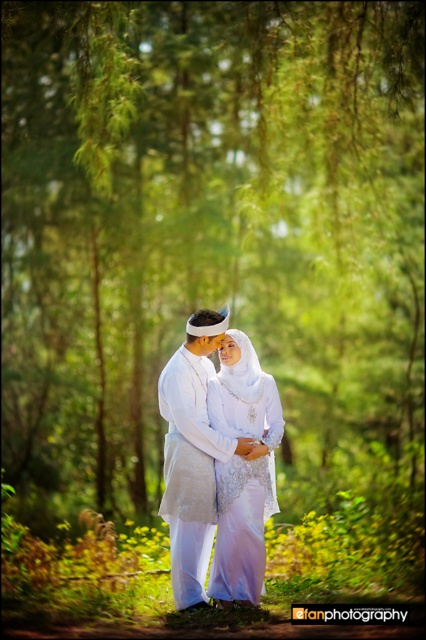
Is point (226, 593) positioned behind point (176, 460)?

No, it is in front of (176, 460).

Between white satin dress at center and white satin robe at center, which one has more height?

white satin robe at center

Does point (244, 378) come farther from viewer compared to point (184, 392)?

Yes, point (244, 378) is farther from viewer.

Identify the location of white satin dress at center. This screenshot has height=640, width=426. (242, 468).